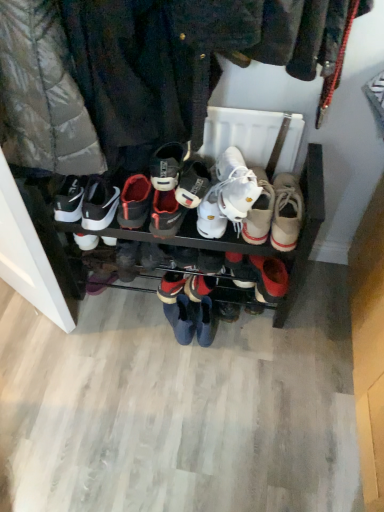
Question: Is white leather sneakers at center, acting as the third footwear starting from the right, spatially inside black leather sneaker at center, the eighth footwear in the right-to-left sequence, or outside of it?

Choices:
 (A) inside
 (B) outside

Answer: (B)

Question: In terms of size, does white leather sneakers at center, which is counted as the sixth footwear, starting from the left, appear bigger or smaller than black leather sneaker at center, the 1th footwear positioned from the left?

Choices:
 (A) small
 (B) big

Answer: (B)

Question: Which object is the farthest from the white leather sneakers at center, positioned as the 5th footwear in left-to-right order?

Choices:
 (A) white synthetic shoe at center, the 3th footwear positioned from the left
 (B) beige canvas shoe at center, marked as the first footwear in a right-to-left arrangement
 (C) blue suede boots at center, the fourth footwear viewed from the left
 (D) white leather sneaker at center, which is counted as the 7th footwear, starting from the right
 (E) black leather sneaker at center, the 1th footwear positioned from the left

Answer: (D)

Question: Which is farther from the white leather sneaker at center, which is counted as the 7th footwear, starting from the right?

Choices:
 (A) beige canvas shoe at center, marked as the first footwear in a right-to-left arrangement
 (B) white synthetic shoe at center, the 3th footwear positioned from the left
 (C) white leather sneakers at center, acting as the third footwear starting from the right
 (D) black leather sneaker at center, the eighth footwear in the right-to-left sequence
 (E) white canvas shoe at center, which is the 7th footwear from left to right

Answer: (A)